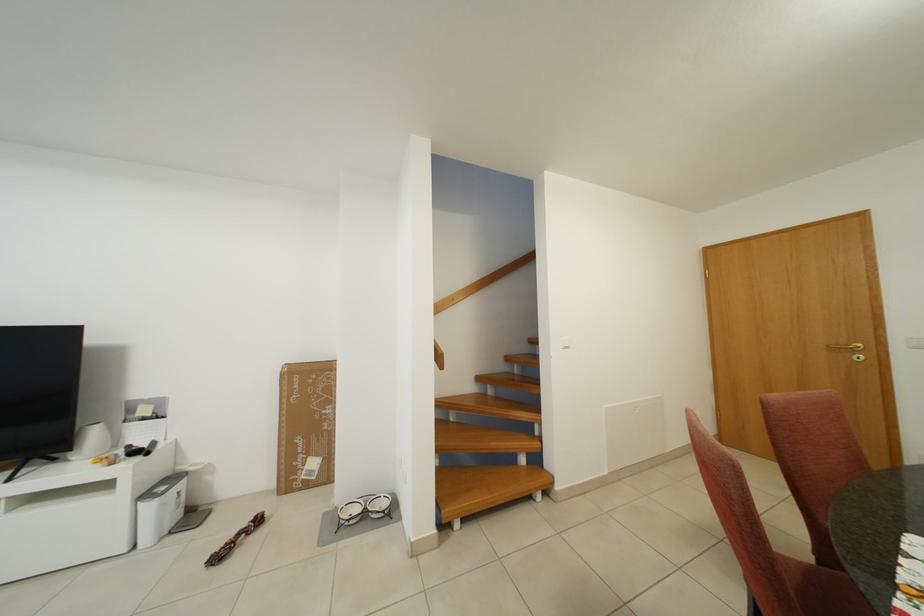
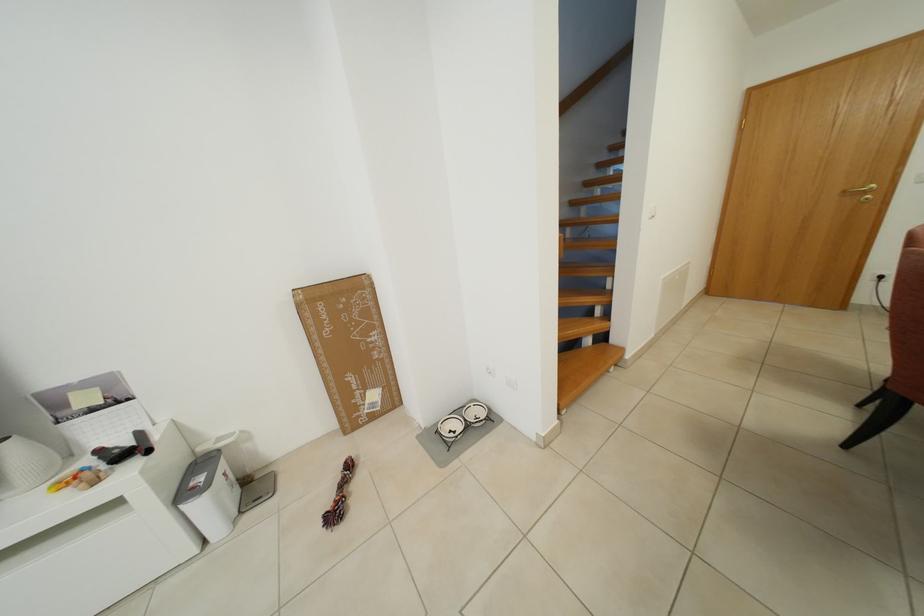
Locate, in the second image, the point that corresponds to pixel 252 528 in the first image.

(346, 479)